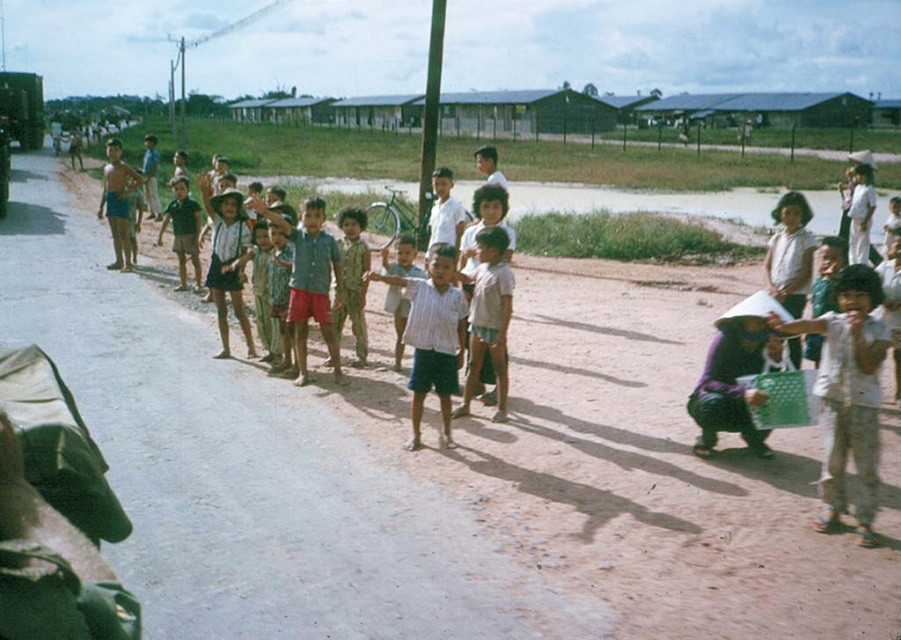
Is white cotton shirt at center to the right of striped shirt at center from the viewer's perspective?

Indeed, white cotton shirt at center is positioned on the right side of striped shirt at center.

Is point (875, 348) behind point (465, 392)?

No, (875, 348) is in front of (465, 392).

What are the coordinates of `white cotton shirt at center` in the screenshot? It's located at (848, 394).